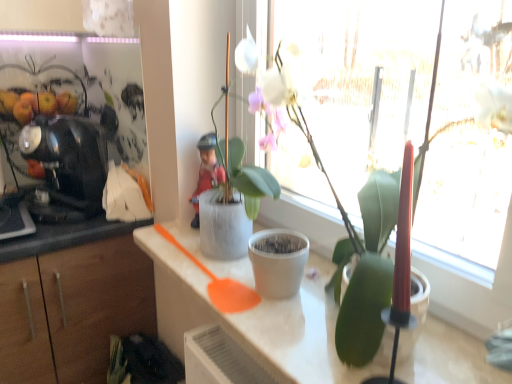
Question: Is white matte flowerpot at center wider than black glossy coffee machine at left?

Choices:
 (A) no
 (B) yes

Answer: (A)

Question: Is white matte flowerpot at center thinner than black glossy coffee machine at left?

Choices:
 (A) yes
 (B) no

Answer: (A)

Question: Is the position of white matte flowerpot at center more distant than that of black glossy coffee machine at left?

Choices:
 (A) yes
 (B) no

Answer: (B)

Question: Is black glossy coffee machine at left completely or partially inside white matte flowerpot at center?

Choices:
 (A) yes
 (B) no

Answer: (B)

Question: Is black glossy coffee machine at left at the back of white matte flowerpot at center?

Choices:
 (A) no
 (B) yes

Answer: (A)

Question: From a real-world perspective, is white matte flowerpot at center positioned over black glossy coffee machine at left based on gravity?

Choices:
 (A) no
 (B) yes

Answer: (A)

Question: Is white matte countertop at center oriented towards black glossy coffee machine at left?

Choices:
 (A) yes
 (B) no

Answer: (B)

Question: From a real-world perspective, is white matte countertop at center under black glossy coffee machine at left?

Choices:
 (A) yes
 (B) no

Answer: (A)

Question: From the image's perspective, is white matte countertop at center under black glossy coffee machine at left?

Choices:
 (A) yes
 (B) no

Answer: (A)

Question: Is white matte countertop at center thinner than black glossy coffee machine at left?

Choices:
 (A) no
 (B) yes

Answer: (A)

Question: Considering the relative sizes of white matte countertop at center and black glossy coffee machine at left in the image provided, is white matte countertop at center wider than black glossy coffee machine at left?

Choices:
 (A) yes
 (B) no

Answer: (A)

Question: Considering the relative positions of white matte countertop at center and black glossy coffee machine at left in the image provided, is white matte countertop at center to the left of black glossy coffee machine at left from the viewer's perspective?

Choices:
 (A) yes
 (B) no

Answer: (B)

Question: Considering the relative sizes of black glossy coffee machine at left and white matte pot at center, the first houseplant viewed from the back, in the image provided, is black glossy coffee machine at left bigger than white matte pot at center, the first houseplant viewed from the back,?

Choices:
 (A) yes
 (B) no

Answer: (B)